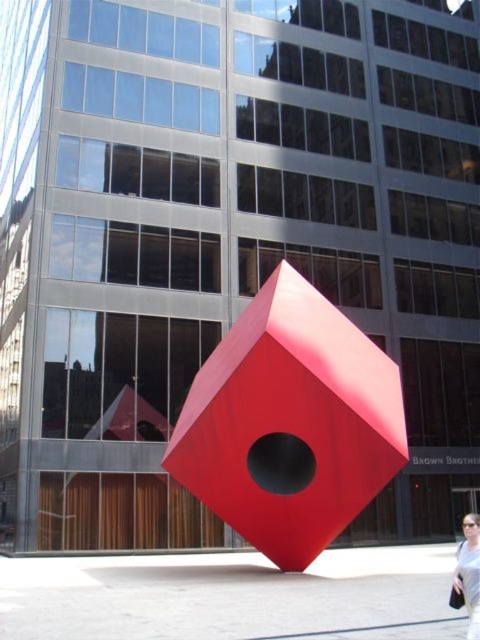
Who is taller, matte red cube at center or matte black sunglasses at lower right?

matte red cube at center is taller.

At what (x,y) coordinates should I click in order to perform the action: click on matte red cube at center. Please return your answer as a coordinate pair (x, y). Looking at the image, I should click on (289, 422).

Who is more distant from viewer, (x=286, y=364) or (x=479, y=630)?

The point (x=286, y=364) is behind.

The image size is (480, 640). In order to click on matte red cube at center in this screenshot , I will do `click(289, 422)`.